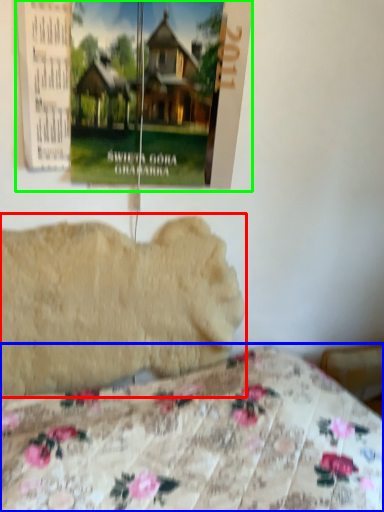
Question: Considering the real-world distances, which object is closest to animal (highlighted by a red box)? bed (highlighted by a blue box) or poster page (highlighted by a green box).

Choices:
 (A) bed
 (B) poster page

Answer: (A)